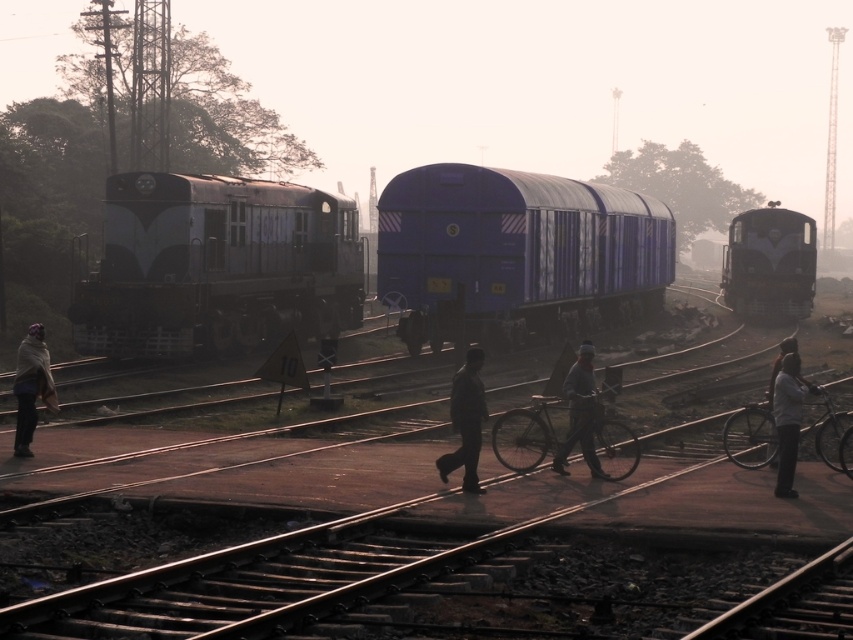
Between point (221, 317) and point (33, 339), which one is positioned in front?

Point (33, 339) is more forward.

This screenshot has height=640, width=853. Find the location of `matte black train at left`. matte black train at left is located at coordinates (218, 266).

Can you confirm if blue matte freight car at center is smaller than gray knit cap at center?

Actually, blue matte freight car at center might be larger than gray knit cap at center.

Who is more forward, [489,321] or [596,458]?

Point [596,458] is more forward.

Does point (393, 268) come in front of point (593, 426)?

No, it is behind (593, 426).

Locate an element on the screen. The image size is (853, 640). blue matte freight car at center is located at coordinates (515, 248).

Can you confirm if matte black train at right is thinner than dark gray suit at center?

No.

Is matte black train at right closer to camera compared to dark gray suit at center?

That is False.

Who is more distant from viewer, (x=809, y=308) or (x=456, y=426)?

The point (x=809, y=308) is more distant.

This screenshot has height=640, width=853. In order to click on matte black train at right in this screenshot , I will do 769,262.